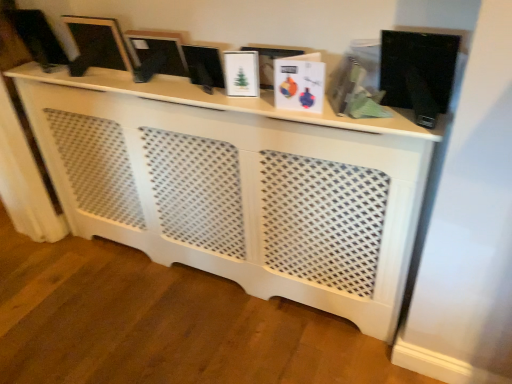
Where is `free spot above white lattice cabinet at center (from a real-world perspective)`? free spot above white lattice cabinet at center (from a real-world perspective) is located at coordinates (176, 88).